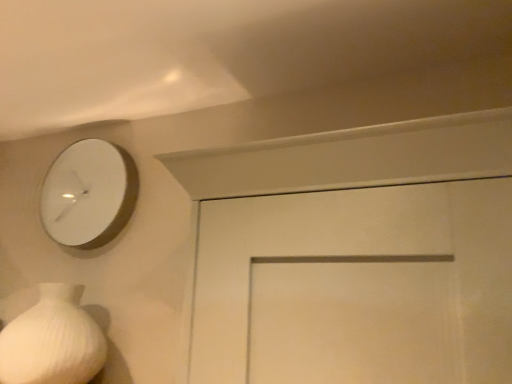
Image resolution: width=512 pixels, height=384 pixels. Find the location of `white ribbed vase at lower left`. white ribbed vase at lower left is located at coordinates (52, 341).

What is the approximate height of white ribbed vase at lower left?

white ribbed vase at lower left is 12.04 inches tall.

Image resolution: width=512 pixels, height=384 pixels. What do you see at coordinates (52, 341) in the screenshot? I see `white ribbed vase at lower left` at bounding box center [52, 341].

At what (x,y) coordinates should I click in order to perform the action: click on white matte clock at upper left. Please return your answer as a coordinate pair (x, y). Looking at the image, I should click on (89, 194).

What do you see at coordinates (89, 194) in the screenshot? Image resolution: width=512 pixels, height=384 pixels. I see `white matte clock at upper left` at bounding box center [89, 194].

What is the approximate width of white matte clock at upper left?

white matte clock at upper left is 2.16 inches wide.

Identify the location of white ribbed vase at lower left. The width and height of the screenshot is (512, 384). [x=52, y=341].

Considering the relative positions of white ribbed vase at lower left and white matte clock at upper left in the image provided, is white ribbed vase at lower left to the right of white matte clock at upper left from the viewer's perspective?

Incorrect, white ribbed vase at lower left is not on the right side of white matte clock at upper left.

Is white ribbed vase at lower left closer to the viewer compared to white matte clock at upper left?

Yes, white ribbed vase at lower left is in front of white matte clock at upper left.

Is point (59, 357) closer or farther from the camera than point (130, 216)?

Point (59, 357) is closer to the camera than point (130, 216).

From the image's perspective, is white ribbed vase at lower left above or below white matte clock at upper left?

Based on their image positions, white ribbed vase at lower left is located beneath white matte clock at upper left.

Looking at this image, from a real-world perspective, who is located higher, white ribbed vase at lower left or white matte clock at upper left?

From a 3D spatial view, white matte clock at upper left is above.

Which object is thinner, white ribbed vase at lower left or white matte clock at upper left?

white matte clock at upper left is thinner.

Is white ribbed vase at lower left shorter than white matte clock at upper left?

Correct, white ribbed vase at lower left is not as tall as white matte clock at upper left.

Considering the sizes of white ribbed vase at lower left and white matte clock at upper left in the image, is white ribbed vase at lower left bigger or smaller than white matte clock at upper left?

Clearly, white ribbed vase at lower left is larger in size than white matte clock at upper left.

Is white ribbed vase at lower left inside or outside of white matte clock at upper left?

white ribbed vase at lower left is not inside white matte clock at upper left, it's outside.

Looking at this image, is white ribbed vase at lower left directly adjacent to white matte clock at upper left?

white ribbed vase at lower left and white matte clock at upper left are clearly separated.

Is white ribbed vase at lower left facing towards white matte clock at upper left?

No, white ribbed vase at lower left is not facing towards white matte clock at upper left.

At what (x,y) coordinates should I click in order to perform the action: click on vase directly beneath the white matte clock at upper left (from a real-world perspective). Please return your answer as a coordinate pair (x, y). Looking at the image, I should click on (52, 341).

Is white matte clock at upper left at the right side of white ribbed vase at lower left?

Correct, you'll find white matte clock at upper left to the right of white ribbed vase at lower left.

Who is more distant, white matte clock at upper left or white ribbed vase at lower left?

white matte clock at upper left is further away from the camera.

Does point (42, 207) lie behind point (5, 366)?

Yes.

From the image's perspective, between white matte clock at upper left and white ribbed vase at lower left, who is located below?

white ribbed vase at lower left, from the image's perspective.

From a real-world perspective, is white matte clock at upper left physically located above or below white ribbed vase at lower left?

Clearly, from a real-world perspective, white matte clock at upper left is above white ribbed vase at lower left.

Considering the relative sizes of white matte clock at upper left and white ribbed vase at lower left in the image provided, is white matte clock at upper left wider than white ribbed vase at lower left?

No.

Considering the relative sizes of white matte clock at upper left and white ribbed vase at lower left in the image provided, is white matte clock at upper left shorter than white ribbed vase at lower left?

Incorrect, the height of white matte clock at upper left does not fall short of that of white ribbed vase at lower left.

Between white matte clock at upper left and white ribbed vase at lower left, which one has larger size?

white ribbed vase at lower left is bigger.

Is white ribbed vase at lower left inside white matte clock at upper left?

That's incorrect, white ribbed vase at lower left is not inside white matte clock at upper left.

Are white matte clock at upper left and white ribbed vase at lower left located far from each other?

No.

Is white ribbed vase at lower left at the back of white matte clock at upper left?

No, white matte clock at upper left is not facing the opposite direction of white ribbed vase at lower left.

How many degrees apart are the facing directions of white matte clock at upper left and white ribbed vase at lower left?

0.622 degrees.

How distant is white matte clock at upper left from white ribbed vase at lower left?

white matte clock at upper left is 13.15 inches from white ribbed vase at lower left.

At what (x,y) coordinates should I click in order to perform the action: click on wall clock lying above the white ribbed vase at lower left (from the image's perspective). Please return your answer as a coordinate pair (x, y). Looking at the image, I should click on (89, 194).

Locate an element on the screen. wall clock that appears above the white ribbed vase at lower left (from the image's perspective) is located at coordinates (89, 194).

Find the location of a particular element. The height and width of the screenshot is (384, 512). vase below the white matte clock at upper left (from the image's perspective) is located at coordinates (52, 341).